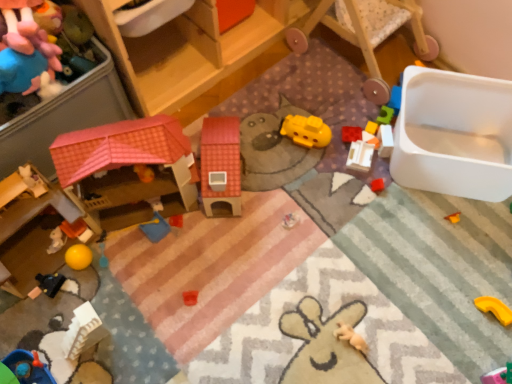
Where is `free space between black matte toy car at lower left, the tenth toy viewed from the right, and white plastic building at center-right, positioned as the 4th toy in right-to-left order`? This screenshot has height=384, width=512. free space between black matte toy car at lower left, the tenth toy viewed from the right, and white plastic building at center-right, positioned as the 4th toy in right-to-left order is located at coordinates tap(230, 215).